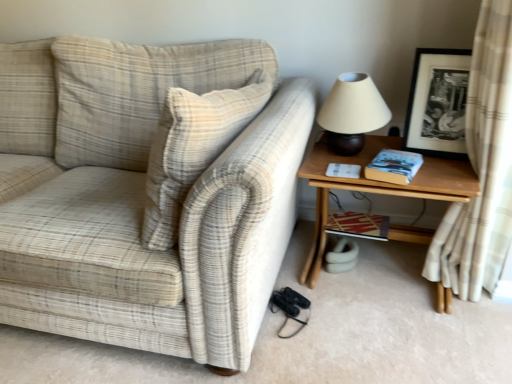
Identify the location of vacant space in front of black matte picture frame at upper right. This screenshot has height=384, width=512. (448, 167).